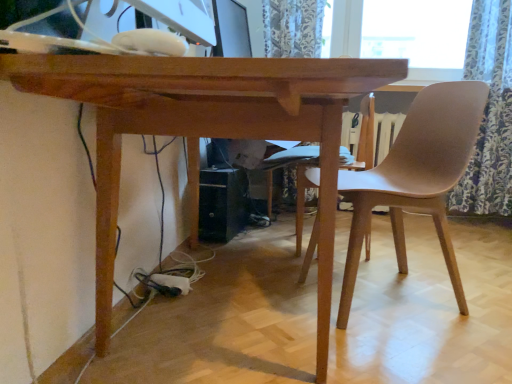
What are the coordinates of `free space in front of matte brown chair at right` in the screenshot? It's located at (398, 349).